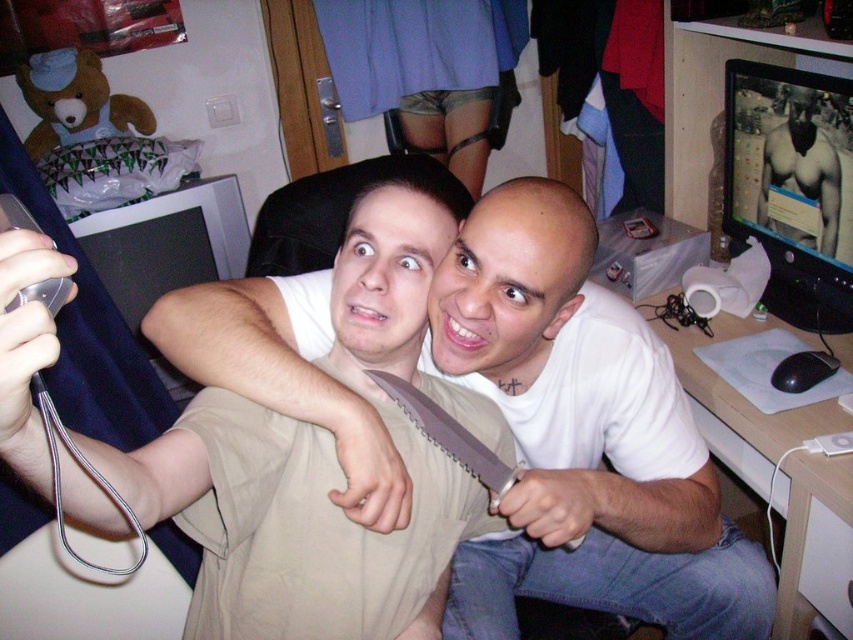
You are organizing a safety inspection in this room. You need to ensure that all sharp objects are stored away. Which object between the white matte shirt at center and the beige fabric knife at upper center is more concerning for safety?

The beige fabric knife at upper center is more concerning for safety because it is a sharp object and is located behind the white matte shirt at center, which might not be properly secured.

You are trying to decide whether to place a new laptop on the desk next to the matte black monitor at upper right and the smooth skin torso at upper right. Which object should you place the laptop next to if you want it to be closer to the larger object?

You should place the laptop next to the matte black monitor at upper right because it is larger than the smooth skin torso at upper right.

You are trying to take a photo of the smooth skin torso at upper right but need to avoid including the matte black monitor at upper right in the frame. Based on their positions, is this possible?

The matte black monitor at upper right is to the left of the smooth skin torso at upper right, so if you position yourself to the right side of the monitor, you can frame the torso without including the monitor.